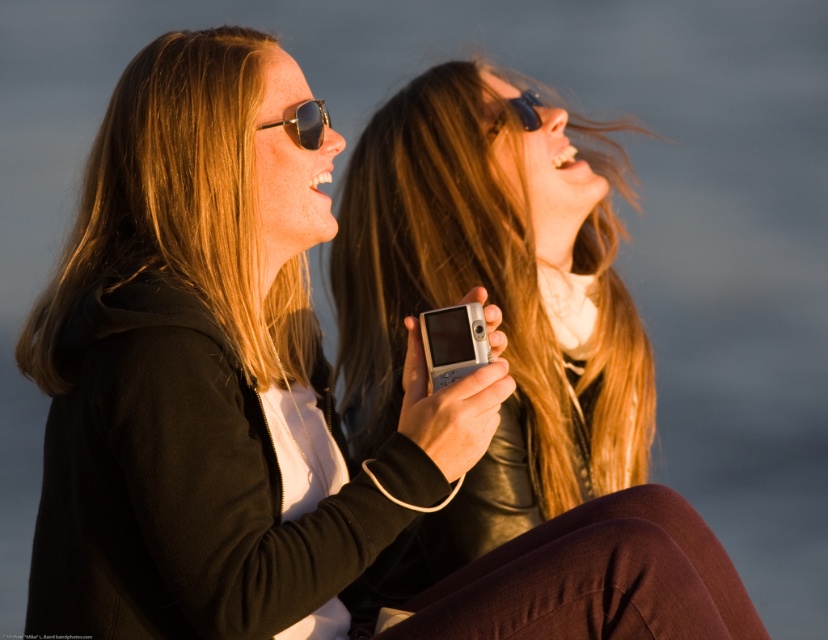
You are a photographer trying to choose between the metallic reflective sunglasses at upper center and the black plastic goggles at upper center for a shoot. Considering their sizes, which one might be more suitable for a closeup portrait to avoid overwhelming the subject?

The metallic reflective sunglasses at upper center occupies less space than the black plastic goggles at upper center, so it would be more suitable for a closeup portrait to avoid overwhelming the subject.

You are standing at the point with coordinates point (533, 99) and want to move to the point with coordinates point (310, 102). Which direction should you move to reach your destination?

You should move forward because point (310, 102) is in front of point (533, 99).